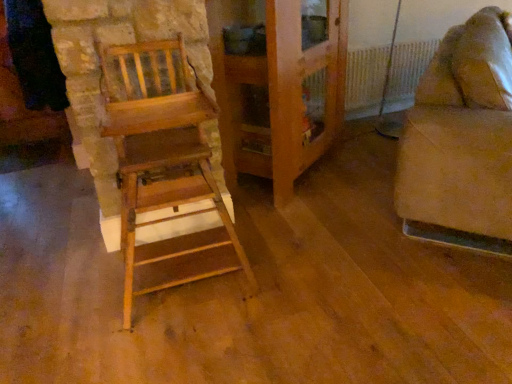
The width and height of the screenshot is (512, 384). What do you see at coordinates (162, 156) in the screenshot?
I see `wooden chair at left, marked as the 2th furniture in a right-to-left arrangement` at bounding box center [162, 156].

The height and width of the screenshot is (384, 512). What do you see at coordinates (385, 76) in the screenshot? I see `white plastic radiator at upper right` at bounding box center [385, 76].

At what (x,y) coordinates should I click in order to perform the action: click on beige fabric couch at right, which is the first furniture from right to left. Please return your answer as a coordinate pair (x, y). The image size is (512, 384). Looking at the image, I should click on (461, 141).

Based on their sizes in the image, would you say white plastic radiator at upper right is bigger or smaller than wooden chair at left, marked as the 2th furniture in a right-to-left arrangement?

In the image, white plastic radiator at upper right appears to be smaller than wooden chair at left, marked as the 2th furniture in a right-to-left arrangement.

Between point (369, 107) and point (146, 184), which one is positioned behind?

The point (369, 107) is more distant.

Which is more to the left, white plastic radiator at upper right or wooden chair at left, placed as the 1th furniture when sorted from left to right?

wooden chair at left, placed as the 1th furniture when sorted from left to right.

Find the location of `radiator above the wooden chair at left, placed as the 1th furniture when sorted from left to right (from the image's perspective)`. radiator above the wooden chair at left, placed as the 1th furniture when sorted from left to right (from the image's perspective) is located at coordinates (385, 76).

How much distance is there between beige fabric couch at right, placed as the 2th furniture when sorted from left to right, and wooden cabinet at center?

beige fabric couch at right, placed as the 2th furniture when sorted from left to right, and wooden cabinet at center are 29.92 inches apart.

Is beige fabric couch at right, which is the first furniture from right to left, facing towards wooden cabinet at center?

No, beige fabric couch at right, which is the first furniture from right to left, is not facing towards wooden cabinet at center.

Between point (415, 204) and point (269, 57), which one is positioned behind?

Positioned behind is point (269, 57).

Which of these two, white plastic radiator at upper right or beige fabric couch at right, placed as the 2th furniture when sorted from left to right, is wider?

Wider between the two is beige fabric couch at right, placed as the 2th furniture when sorted from left to right.

From the image's perspective, which is below, white plastic radiator at upper right or beige fabric couch at right, which is the first furniture from right to left?

beige fabric couch at right, which is the first furniture from right to left, from the image's perspective.

Based on the photo, can you confirm if white plastic radiator at upper right is smaller than beige fabric couch at right, placed as the 2th furniture when sorted from left to right?

Yes, white plastic radiator at upper right is smaller than beige fabric couch at right, placed as the 2th furniture when sorted from left to right.

Where is `radiator above the beige fabric couch at right, placed as the 2th furniture when sorted from left to right (from the image's perspective)`? radiator above the beige fabric couch at right, placed as the 2th furniture when sorted from left to right (from the image's perspective) is located at coordinates (385, 76).

Does wooden chair at left, marked as the 2th furniture in a right-to-left arrangement, have a greater height compared to white plastic radiator at upper right?

Yes, wooden chair at left, marked as the 2th furniture in a right-to-left arrangement, is taller than white plastic radiator at upper right.

The height and width of the screenshot is (384, 512). I want to click on radiator behind the wooden chair at left, marked as the 2th furniture in a right-to-left arrangement, so click(x=385, y=76).

Is point (206, 190) closer to camera compared to point (415, 82)?

Yes.

You are a GUI agent. You are given a task and a screenshot of the screen. Output one action in this format:
    pyautogui.click(x=<x>, y=<y>)
    Task: Click on the dresser above the white plastic radiator at upper right (from a real-world perspective)
    The height and width of the screenshot is (384, 512).
    Given the screenshot: What is the action you would take?
    pyautogui.click(x=277, y=91)

Is white plastic radiator at upper right turned away from wooden cabinet at center?

white plastic radiator at upper right does not have its back to wooden cabinet at center.

Does white plastic radiator at upper right have a larger size compared to wooden cabinet at center?

No.

Considering the relative positions of white plastic radiator at upper right and wooden cabinet at center in the image provided, is white plastic radiator at upper right to the left or to the right of wooden cabinet at center?

From the image, it's evident that white plastic radiator at upper right is to the right of wooden cabinet at center.

Is beige fabric couch at right, which is the first furniture from right to left, turned away from wooden chair at left, marked as the 2th furniture in a right-to-left arrangement?

No, wooden chair at left, marked as the 2th furniture in a right-to-left arrangement, is not at the back of beige fabric couch at right, which is the first furniture from right to left.

Is beige fabric couch at right, placed as the 2th furniture when sorted from left to right, placed right next to wooden chair at left, placed as the 1th furniture when sorted from left to right?

No, beige fabric couch at right, placed as the 2th furniture when sorted from left to right, is not next to wooden chair at left, placed as the 1th furniture when sorted from left to right.

Which is closer to the camera, (446, 169) or (203, 101)?

The point (203, 101) is closer to the camera.

Is beige fabric couch at right, placed as the 2th furniture when sorted from left to right, to the left of white plastic radiator at upper right from the viewer's perspective?

Incorrect, beige fabric couch at right, placed as the 2th furniture when sorted from left to right, is not on the left side of white plastic radiator at upper right.

From a real-world perspective, is beige fabric couch at right, placed as the 2th furniture when sorted from left to right, under white plastic radiator at upper right?

Actually, beige fabric couch at right, placed as the 2th furniture when sorted from left to right, is physically above white plastic radiator at upper right in the real world.

How distant is beige fabric couch at right, which is the first furniture from right to left, from white plastic radiator at upper right?

They are 1.15 meters apart.

Considering the relative sizes of beige fabric couch at right, placed as the 2th furniture when sorted from left to right, and white plastic radiator at upper right in the image provided, is beige fabric couch at right, placed as the 2th furniture when sorted from left to right, shorter than white plastic radiator at upper right?

Incorrect, the height of beige fabric couch at right, placed as the 2th furniture when sorted from left to right, does not fall short of that of white plastic radiator at upper right.

Identify the location of radiator lying behind the wooden chair at left, placed as the 1th furniture when sorted from left to right. This screenshot has width=512, height=384. (385, 76).

Image resolution: width=512 pixels, height=384 pixels. There is a wooden cabinet at center. Find the location of `the 2nd furniture below it (from a real-world perspective)`. the 2nd furniture below it (from a real-world perspective) is located at coordinates (461, 141).

When comparing their distances from wooden cabinet at center, does beige fabric couch at right, which is the first furniture from right to left, or white plastic radiator at upper right seem further?

beige fabric couch at right, which is the first furniture from right to left.

Based on their spatial positions, is wooden chair at left, marked as the 2th furniture in a right-to-left arrangement, or white plastic radiator at upper right closer to beige fabric couch at right, which is the first furniture from right to left?

The object closer to beige fabric couch at right, which is the first furniture from right to left, is wooden chair at left, marked as the 2th furniture in a right-to-left arrangement.

Looking at the image, which one is located closer to beige fabric couch at right, which is the first furniture from right to left, white plastic radiator at upper right or wooden chair at left, marked as the 2th furniture in a right-to-left arrangement?

wooden chair at left, marked as the 2th furniture in a right-to-left arrangement.

Which object lies nearer to the anchor point wooden cabinet at center, beige fabric couch at right, placed as the 2th furniture when sorted from left to right, or wooden chair at left, marked as the 2th furniture in a right-to-left arrangement?

wooden chair at left, marked as the 2th furniture in a right-to-left arrangement, is positioned closer to the anchor wooden cabinet at center.

When comparing their distances from wooden cabinet at center, does white plastic radiator at upper right or wooden chair at left, placed as the 1th furniture when sorted from left to right, seem further?

white plastic radiator at upper right is positioned further to the anchor wooden cabinet at center.

From the image, which object appears to be nearer to white plastic radiator at upper right, wooden cabinet at center or wooden chair at left, placed as the 1th furniture when sorted from left to right?

wooden cabinet at center is closer to white plastic radiator at upper right.

From the image, which object appears to be farther from white plastic radiator at upper right, wooden chair at left, placed as the 1th furniture when sorted from left to right, or wooden cabinet at center?

wooden chair at left, placed as the 1th furniture when sorted from left to right, is further to white plastic radiator at upper right.

Looking at this image, from the image, which object appears to be nearer to wooden cabinet at center, wooden chair at left, placed as the 1th furniture when sorted from left to right, or beige fabric couch at right, placed as the 2th furniture when sorted from left to right?

wooden chair at left, placed as the 1th furniture when sorted from left to right, is closer to wooden cabinet at center.

Where is `dresser between beige fabric couch at right, placed as the 2th furniture when sorted from left to right, and white plastic radiator at upper right, along the z-axis`? This screenshot has width=512, height=384. dresser between beige fabric couch at right, placed as the 2th furniture when sorted from left to right, and white plastic radiator at upper right, along the z-axis is located at coordinates (277, 91).

Find the location of a particular element. dresser between wooden chair at left, placed as the 1th furniture when sorted from left to right, and white plastic radiator at upper right in the front-back direction is located at coordinates (277, 91).

Locate an element on the screen. dresser located between wooden chair at left, marked as the 2th furniture in a right-to-left arrangement, and beige fabric couch at right, which is the first furniture from right to left, in the left-right direction is located at coordinates (277, 91).

You are a GUI agent. You are given a task and a screenshot of the screen. Output one action in this format:
    pyautogui.click(x=<x>, y=<y>)
    Task: Click on the furniture located between wooden chair at left, marked as the 2th furniture in a right-to-left arrangement, and white plastic radiator at upper right in the depth direction
    Image resolution: width=512 pixels, height=384 pixels.
    Given the screenshot: What is the action you would take?
    (x=461, y=141)